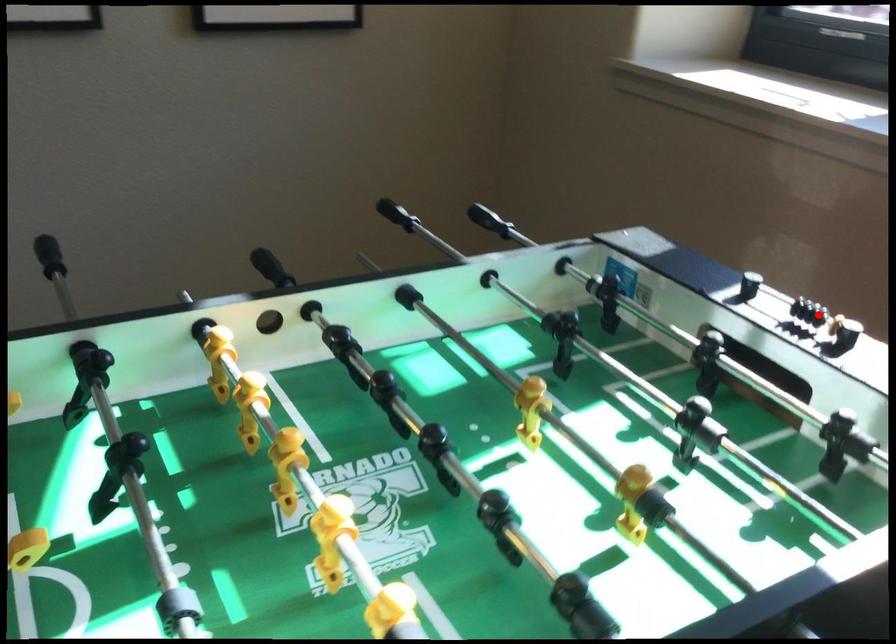
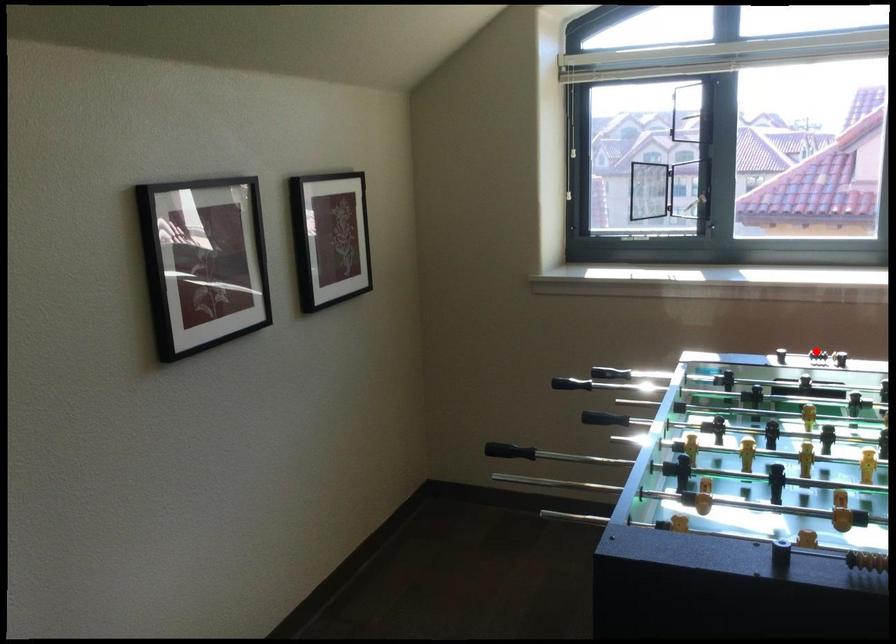
I am providing you with two images of the same scene from different viewpoints. A red point is marked on the first image and another point is marked on the second image. Do the highlighted points in image1 and image2 indicate the same real-world spot?

Yes